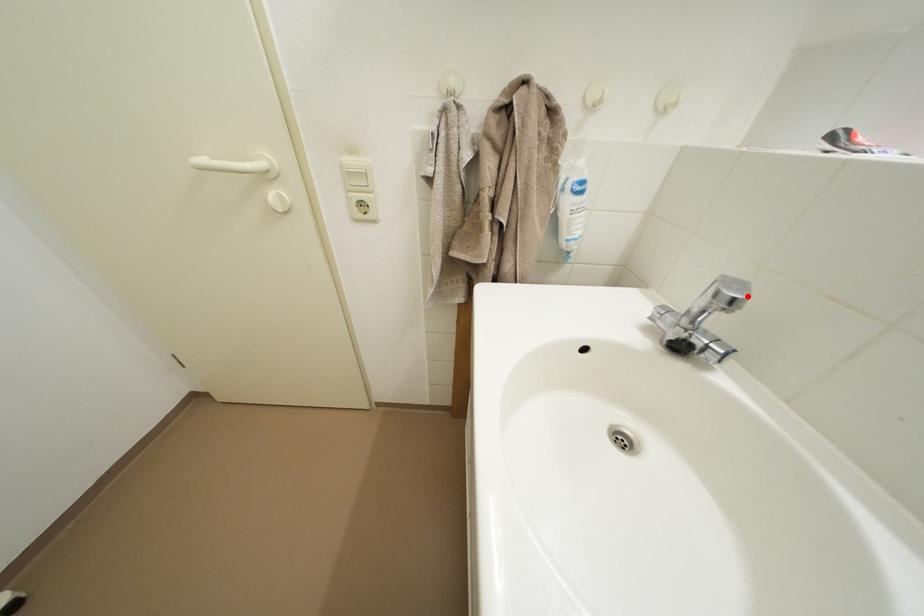
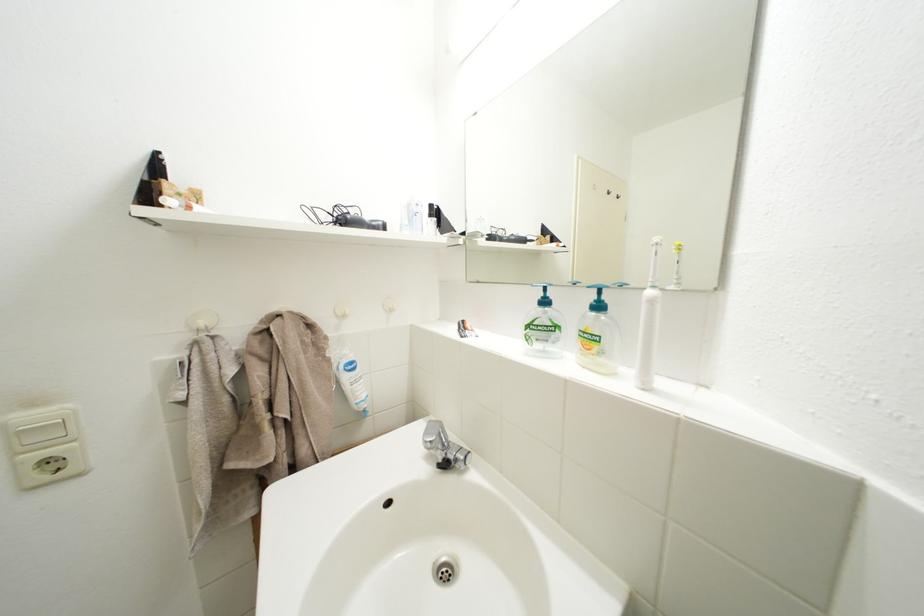
Find the pixel in the second image that matches the highlighted location in the first image.

(441, 440)